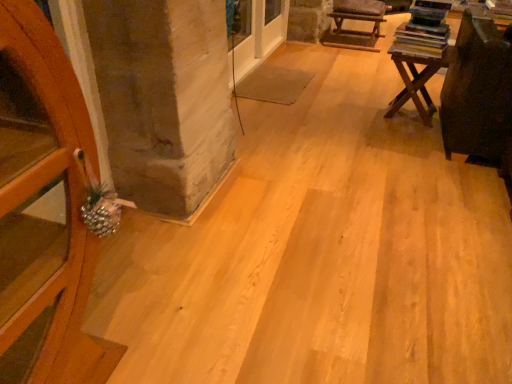
The height and width of the screenshot is (384, 512). I want to click on free point behind wooden table at right, so click(374, 94).